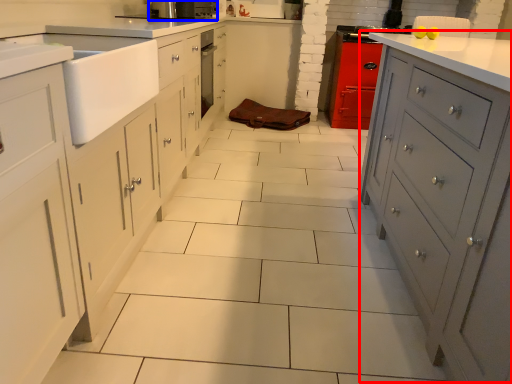
Question: Which object is closer to the camera taking this photo, file cabinet (highlighted by a red box) or home appliance (highlighted by a blue box)?

Choices:
 (A) file cabinet
 (B) home appliance

Answer: (A)